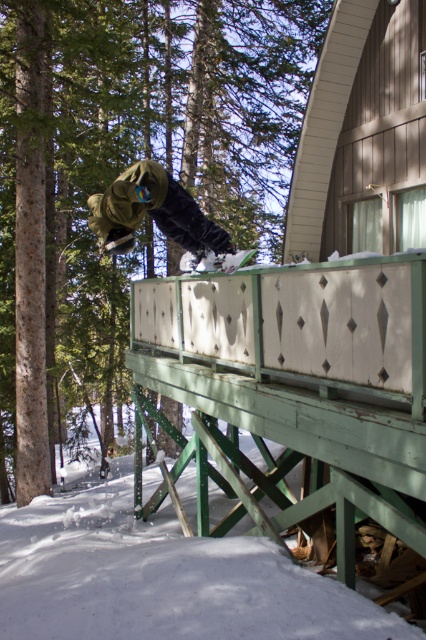
You are a photographer trying to capture the snowboarder midair. You notice a white fluffy snow at lower left located at point (163, 579). Where should you position your camera to ensure the snowboarder is centered in the frame while avoiding the snow at lower left?

To center the snowboarder while avoiding the white fluffy snow at lower left located at point (163, 579), position the camera slightly to the right and above the snow location. This adjustment ensures the snowboarder remains centered while the snow at lower left is excluded from the frame.

You are a photographer capturing the snowboarder midair. You want to ensure the green matte snowboarder at center and the white matte snowboard at center are both clearly visible in your shot. Which object should you focus on first to ensure both are in focus?

The green matte snowboarder at center is in front of the white matte snowboard at center. To ensure both are in focus, you should focus on the green matte snowboarder at center first since it is closer to the camera.

You are a photographer standing at the camera position. You want to capture the green matte snowboarder at center performing their trick. If your camera has a minimum focus distance of 5 meters, will you be able to focus on the snowboarder?

The green matte snowboarder at center and camera are 5.27 meters apart from each other. Since the distance is greater than the camera minimum focus distance of 5 meters, the camera can focus on the snowboarder.